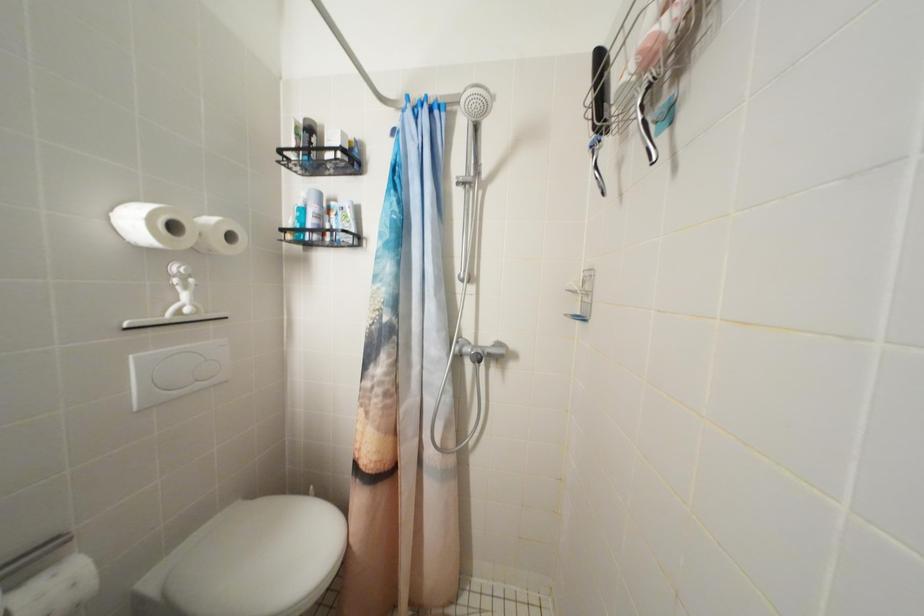
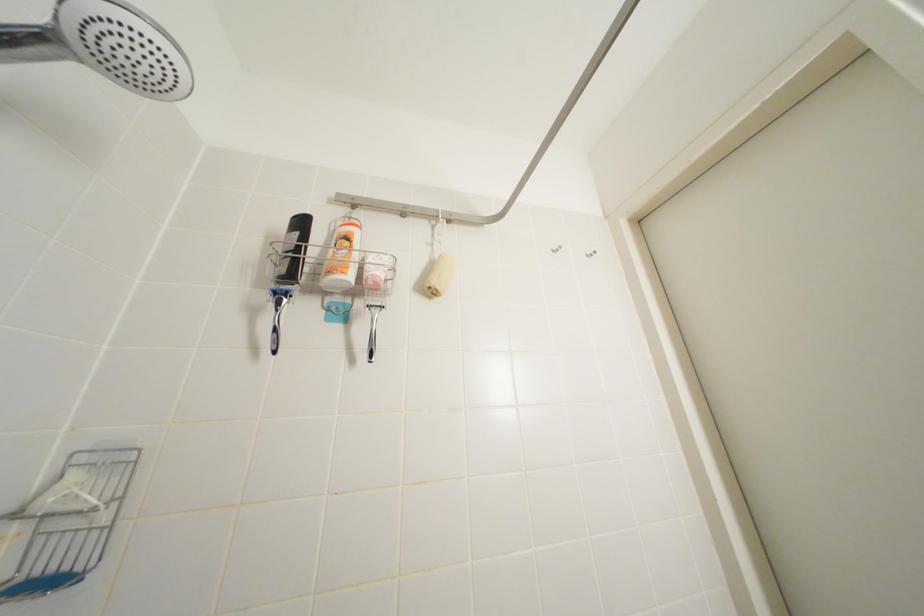
The images are taken continuously from a first-person perspective. In which direction is your viewpoint rotating?

The camera rotated toward right-up.